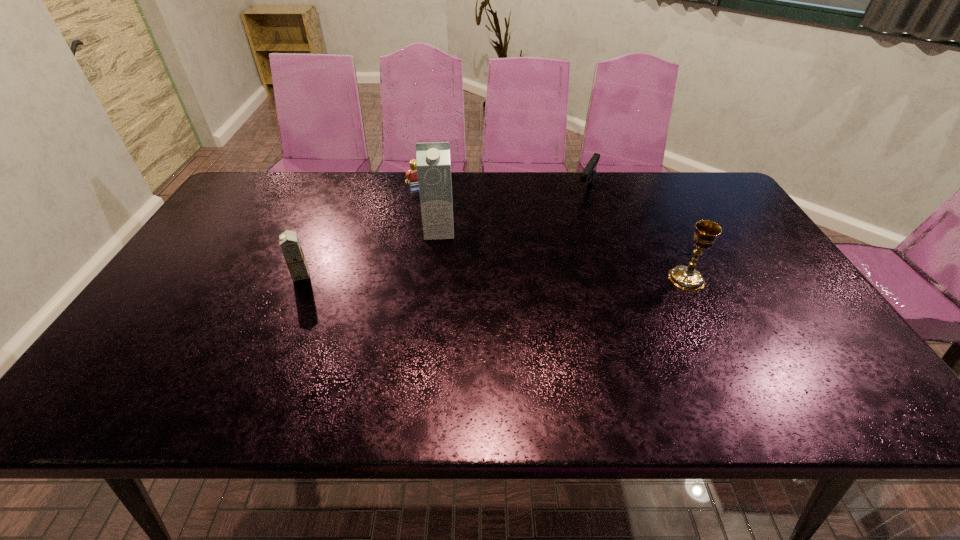
Identify the location of Lego that is positioned at the far edge. (412, 172).

In the image, there is a desktop. Where is `vacant space at the far edge`? This screenshot has height=540, width=960. vacant space at the far edge is located at coordinates (651, 173).

In the image, there is a desktop. Identify the location of vacant space at the near edge. (685, 348).

Locate an element on the screen. Image resolution: width=960 pixels, height=540 pixels. free space at the left edge of the desktop is located at coordinates (214, 251).

Locate an element on the screen. free space at the right edge of the desktop is located at coordinates pos(768,309).

Locate an element on the screen. The width and height of the screenshot is (960, 540). free space at the far right corner of the desktop is located at coordinates (723, 200).

The height and width of the screenshot is (540, 960). I want to click on vacant space that is in between the rightmost object and the leftmost object, so click(x=493, y=277).

Locate an element on the screen. free point between the fourth object from right to left and the chocolate milk is located at coordinates (359, 232).

Image resolution: width=960 pixels, height=540 pixels. What are the coordinates of `vacant space that's between the third nearest object and the third shortest object` in the screenshot? It's located at (370, 253).

The height and width of the screenshot is (540, 960). I want to click on free space between the fourth object from left to right and the chalice, so click(636, 235).